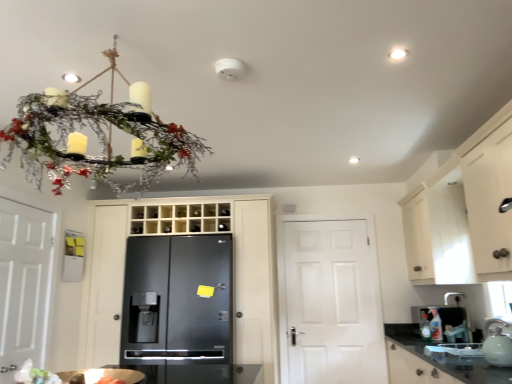
The width and height of the screenshot is (512, 384). Identify the location of free point above matte white chandelier at upper left (from a real-world perspective). (115, 38).